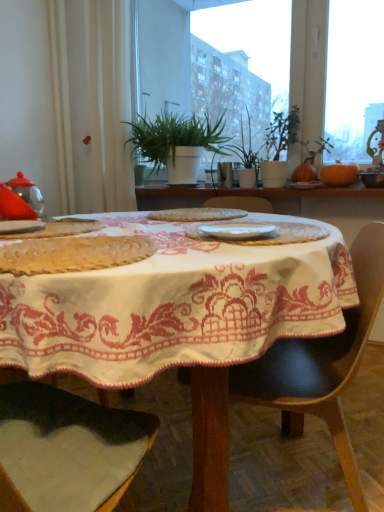
Question: Could green matte plant at center, the first houseplant from the right, be considered to be inside black leather chair at center?

Choices:
 (A) yes
 (B) no

Answer: (B)

Question: Does black leather chair at center have a larger size compared to green matte plant at center, which is counted as the 2th houseplant, starting from the left?

Choices:
 (A) yes
 (B) no

Answer: (A)

Question: Can you confirm if black leather chair at center is smaller than green matte plant at center, which is counted as the 2th houseplant, starting from the left?

Choices:
 (A) yes
 (B) no

Answer: (B)

Question: Considering the relative positions of black leather chair at center and green matte plant at center, which is counted as the 2th houseplant, starting from the left, in the image provided, is black leather chair at center to the left of green matte plant at center, which is counted as the 2th houseplant, starting from the left, from the viewer's perspective?

Choices:
 (A) no
 (B) yes

Answer: (B)

Question: Does black leather chair at center come behind green matte plant at center, which is counted as the 2th houseplant, starting from the left?

Choices:
 (A) no
 (B) yes

Answer: (A)

Question: Relative to matte white plate at center, which is the fourth tableware in left-to-right order, is white embroidered tablecloth at center in front or behind?

Choices:
 (A) behind
 (B) front

Answer: (B)

Question: Considering the positions of white embroidered tablecloth at center and matte white plate at center, which is counted as the 1th tableware, starting from the back, in the image, is white embroidered tablecloth at center wider or thinner than matte white plate at center, which is counted as the 1th tableware, starting from the back,?

Choices:
 (A) thin
 (B) wide

Answer: (B)

Question: From their relative heights in the image, would you say white embroidered tablecloth at center is taller or shorter than matte white plate at center, which is counted as the 1th tableware, starting from the back?

Choices:
 (A) tall
 (B) short

Answer: (A)

Question: Considering the positions of point (46, 312) and point (314, 187), is point (46, 312) closer or farther from the camera than point (314, 187)?

Choices:
 (A) farther
 (B) closer

Answer: (B)

Question: Is matte ceramic bowl at upper right, positioned as the 5th tableware in left-to-right order, spatially inside white embroidered tablecloth at center, or outside of it?

Choices:
 (A) inside
 (B) outside

Answer: (B)

Question: In terms of height, does matte ceramic bowl at upper right, positioned as the 5th tableware in bottom-to-top order, look taller or shorter compared to white embroidered tablecloth at center?

Choices:
 (A) tall
 (B) short

Answer: (B)

Question: In terms of width, does matte ceramic bowl at upper right, which is counted as the second tableware, starting from the back, look wider or thinner when compared to white embroidered tablecloth at center?

Choices:
 (A) wide
 (B) thin

Answer: (B)

Question: In the image, is matte ceramic bowl at upper right, which is counted as the second tableware, starting from the back, on the left side or the right side of white embroidered tablecloth at center?

Choices:
 (A) left
 (B) right

Answer: (B)

Question: Is white glossy plate at center, which is the first tableware in front-to-back order, bigger or smaller than matte white plate at center, which is the fourth tableware in left-to-right order?

Choices:
 (A) big
 (B) small

Answer: (B)

Question: Considering the positions of point (251, 232) and point (311, 183), is point (251, 232) closer or farther from the camera than point (311, 183)?

Choices:
 (A) closer
 (B) farther

Answer: (A)